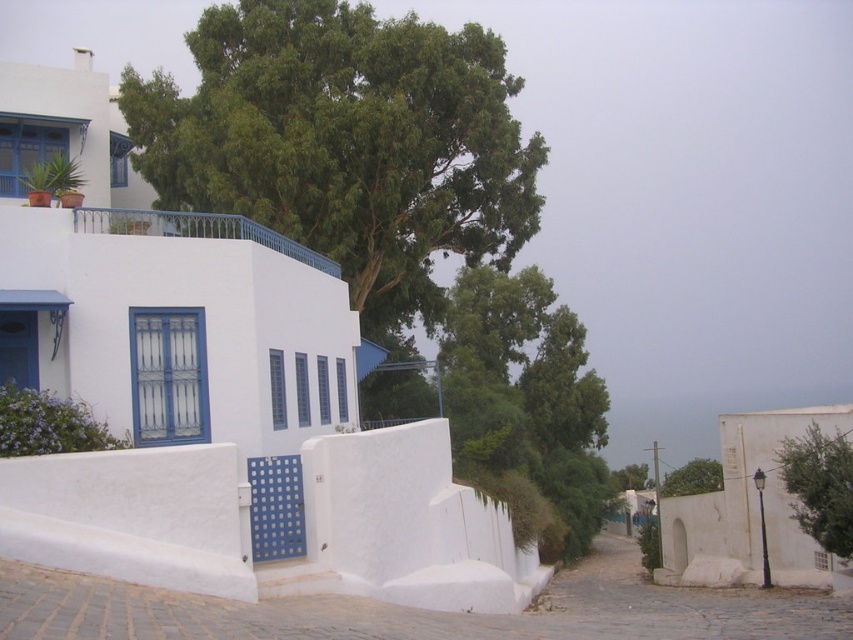
Question: In this image, where is green leafy tree at right located relative to green leafy tree at center?

Choices:
 (A) left
 (B) right

Answer: (A)

Question: Which object is closer to the camera taking this photo?

Choices:
 (A) green leafy tree at right
 (B) green leafy tree at upper center
 (C) green leafy tree at center

Answer: (A)

Question: Which of the following is the closest to the observer?

Choices:
 (A) green leafy tree at right
 (B) green leafy tree at upper center

Answer: (A)

Question: Which point is farther from the camera taking this photo?

Choices:
 (A) (468, 259)
 (B) (840, 550)

Answer: (A)

Question: Does green leafy tree at upper center appear on the right side of green leafy tree at center?

Choices:
 (A) no
 (B) yes

Answer: (A)

Question: Is green leafy tree at upper center to the left of green leafy tree at center from the viewer's perspective?

Choices:
 (A) yes
 (B) no

Answer: (A)